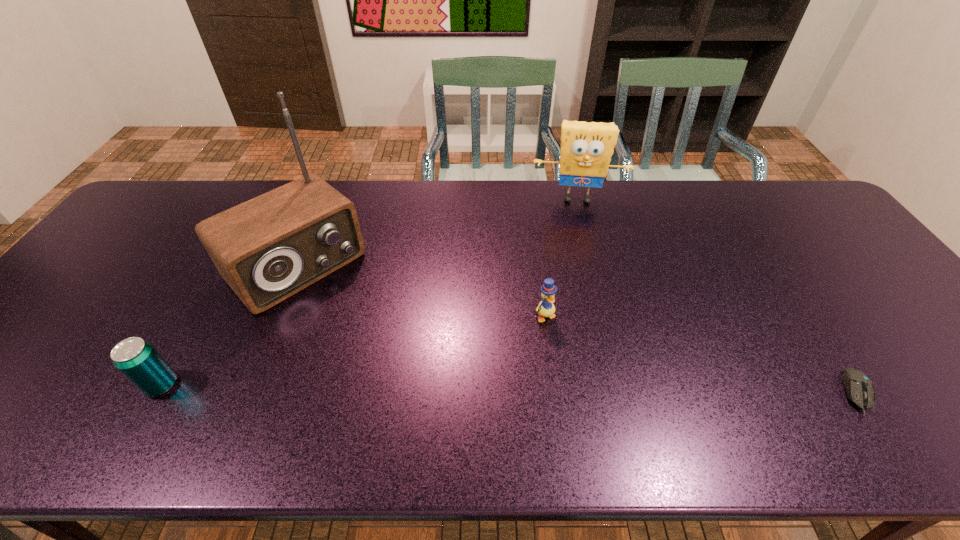
This screenshot has width=960, height=540. Identify the location of free space located 0.160m on the face of the farthest object. (576, 243).

The width and height of the screenshot is (960, 540). I want to click on vacant space located on the face of the farthest object, so click(x=578, y=272).

Locate an element on the screen. free spot located on the face of the duckling, where the monocle is placed is located at coordinates (577, 361).

Where is `free spot located 0.130m on the face of the duckling, where the monocle is placed`? This screenshot has width=960, height=540. free spot located 0.130m on the face of the duckling, where the monocle is placed is located at coordinates (580, 364).

At what (x,y) coordinates should I click in order to perform the action: click on free region located on the face of the duckling, where the monocle is placed. Please return your answer as a coordinate pair (x, y). This screenshot has height=540, width=960. Looking at the image, I should click on (587, 374).

You are a GUI agent. You are given a task and a screenshot of the screen. Output one action in this format:
    pyautogui.click(x=<x>, y=<y>)
    Task: Click on the vacant space located on the front-facing side of the tallest object
    The height and width of the screenshot is (540, 960).
    Given the screenshot: What is the action you would take?
    pyautogui.click(x=418, y=386)

Image resolution: width=960 pixels, height=540 pixels. What are the coordinates of `vacant space located on the front-facing side of the tallest object` in the screenshot? It's located at (368, 337).

Where is `vacant position located on the front-facing side of the tallest object`? This screenshot has height=540, width=960. vacant position located on the front-facing side of the tallest object is located at coordinates (415, 383).

You are a GUI agent. You are given a task and a screenshot of the screen. Output one action in this format:
    pyautogui.click(x=<x>, y=<y>)
    Task: Click on the sponge that is at the far edge
    This screenshot has width=960, height=540.
    Given the screenshot: What is the action you would take?
    pyautogui.click(x=586, y=148)

Where is `radio receiver that is at the far edge`? radio receiver that is at the far edge is located at coordinates (267, 249).